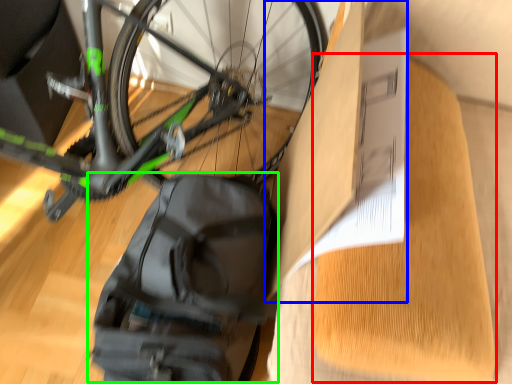
Question: Which is nearer to the cardboard (highlighted by a red box)? cardboard box (highlighted by a blue box) or backpack (highlighted by a green box).

Choices:
 (A) cardboard box
 (B) backpack

Answer: (A)